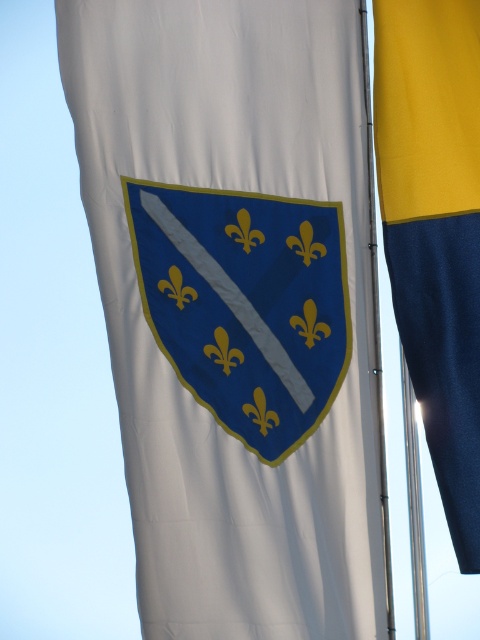
Can you confirm if blue fabric shield at center is wider than metallic silver pole at center?

Yes.

Is point (178, 496) positioned behind point (373, 264)?

Yes, it is.

The width and height of the screenshot is (480, 640). Find the location of `blue fabric shield at center`. blue fabric shield at center is located at coordinates (236, 305).

Can you confirm if yellow fabric flag at right is thinner than metallic silver pole at center?

No, yellow fabric flag at right is not thinner than metallic silver pole at center.

Can you confirm if yellow fabric flag at right is taller than metallic silver pole at center?

No.

Where is `yellow fabric flag at right`? This screenshot has width=480, height=640. yellow fabric flag at right is located at coordinates (434, 228).

Who is shorter, blue fabric shield at center or yellow fabric flag at right?

yellow fabric flag at right is shorter.

Does point (317, 100) come farther from viewer compared to point (470, 92)?

Yes, it is.

Is point (192, 548) in front of point (475, 454)?

That is False.

The width and height of the screenshot is (480, 640). I want to click on blue fabric shield at center, so click(236, 305).